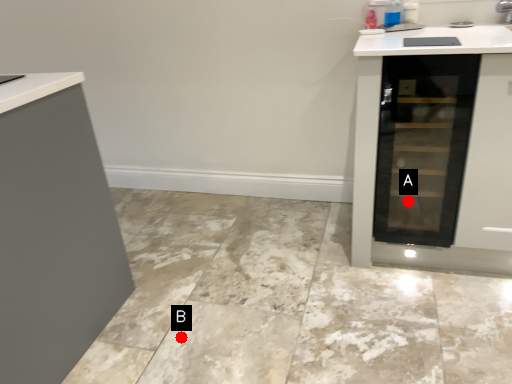
Question: Two points are circled on the image, labeled by A and B beside each circle. Which point is farther to the camera?

Choices:
 (A) A is further
 (B) B is further

Answer: (A)